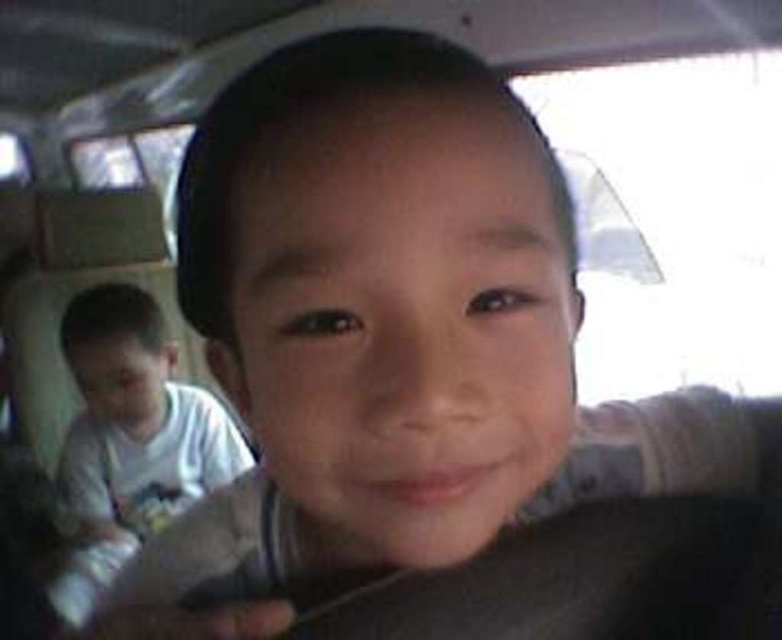
Question: Where is transparent plastic car window at upper right located in relation to white cotton shirt at center in the image?

Choices:
 (A) right
 (B) left

Answer: (A)

Question: Which of the following is the closest to the observer?

Choices:
 (A) white cotton shirt at center
 (B) transparent plastic car window at upper right

Answer: (B)

Question: Does transparent plastic car window at upper right have a lesser width compared to white cotton shirt at center?

Choices:
 (A) no
 (B) yes

Answer: (A)

Question: Considering the relative positions of transparent plastic car window at upper right and white cotton shirt at center in the image provided, where is transparent plastic car window at upper right located with respect to white cotton shirt at center?

Choices:
 (A) left
 (B) right

Answer: (B)

Question: Which point is farther to the camera?

Choices:
 (A) (745, 60)
 (B) (167, 440)

Answer: (B)

Question: Which point is closer to the camera taking this photo?

Choices:
 (A) (700, 148)
 (B) (131, 440)

Answer: (A)